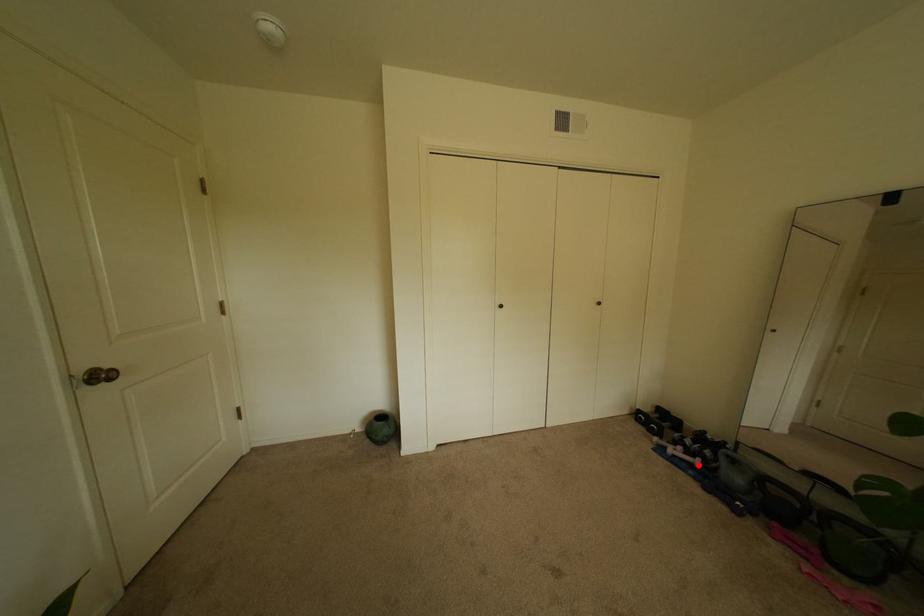
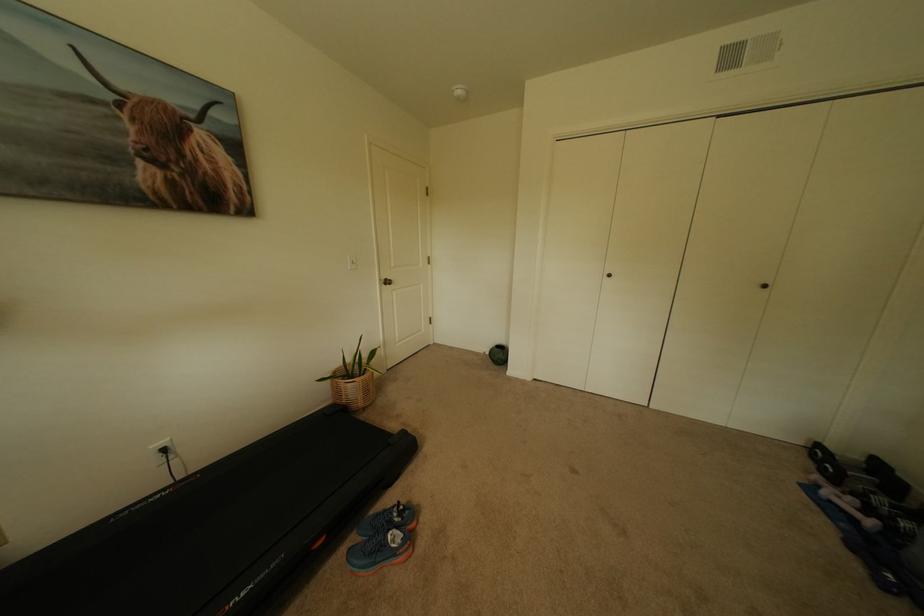
Question: I am providing you with two images of the same scene from different viewpoints. In image1, a red point is highlighted. Considering the same 3D point in image2, which of the following is correct?

Choices:
 (A) It is closer
 (B) It is farther

Answer: (A)